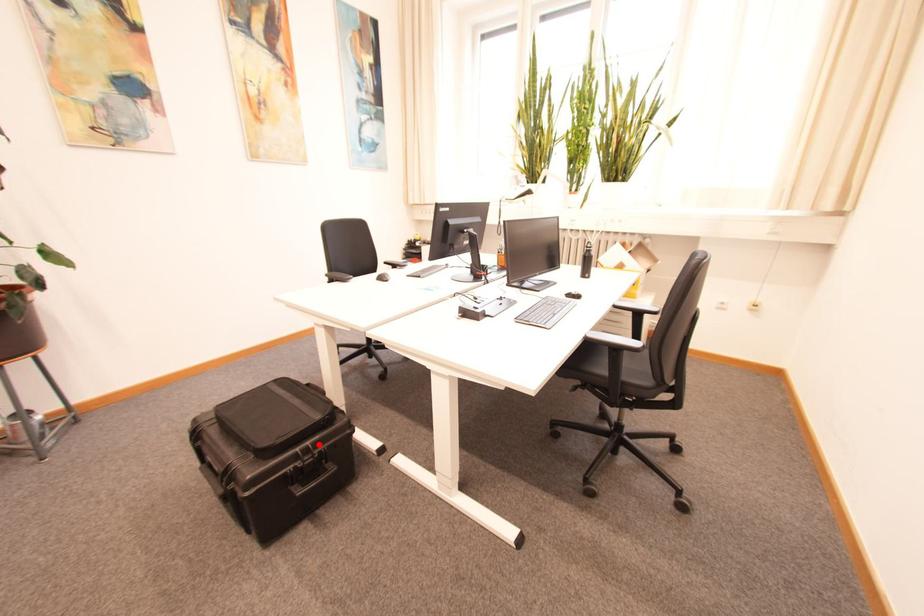
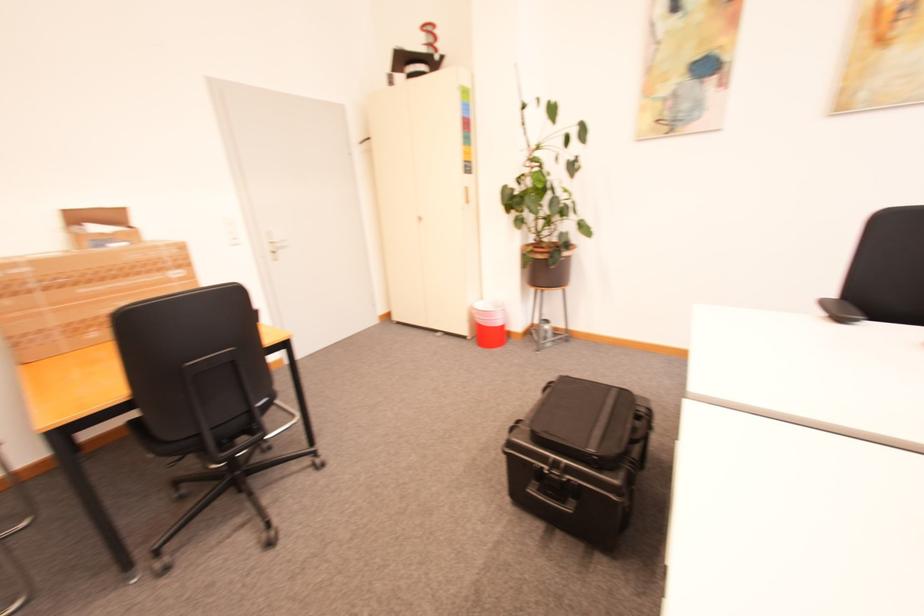
In the second image, find the point that corresponds to the highlighted location in the first image.

(574, 467)